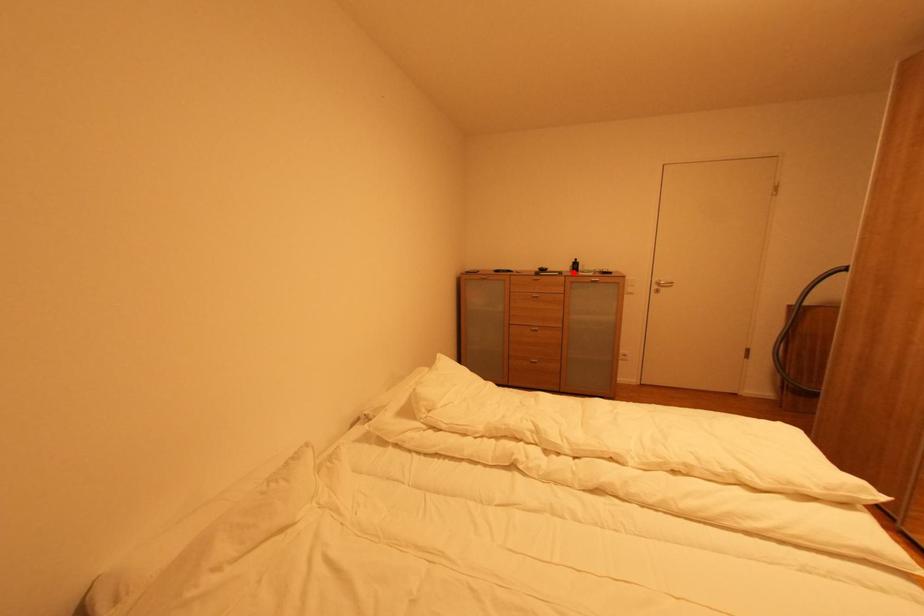
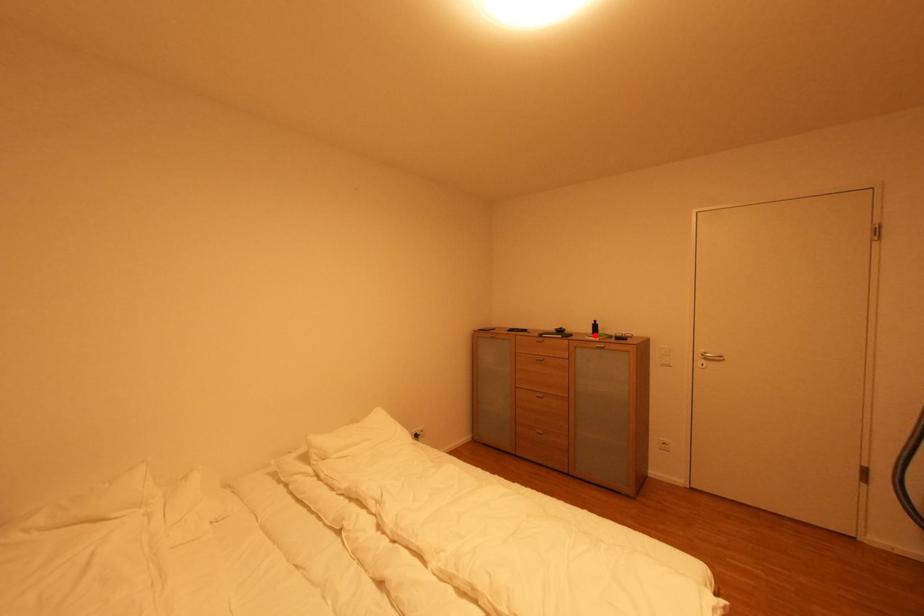
I am providing you with two images of the same scene from different viewpoints. A red point is marked on the first image and another point is marked on the second image. Are the points marked in image1 and image2 representing the same 3D position?

Yes